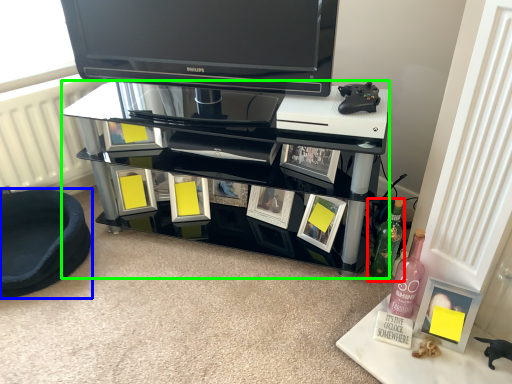
Question: Which object is the farthest from bottle (highlighted by a red box)? Choose among these: furniture (highlighted by a blue box) or shelf (highlighted by a green box).

Choices:
 (A) furniture
 (B) shelf

Answer: (A)